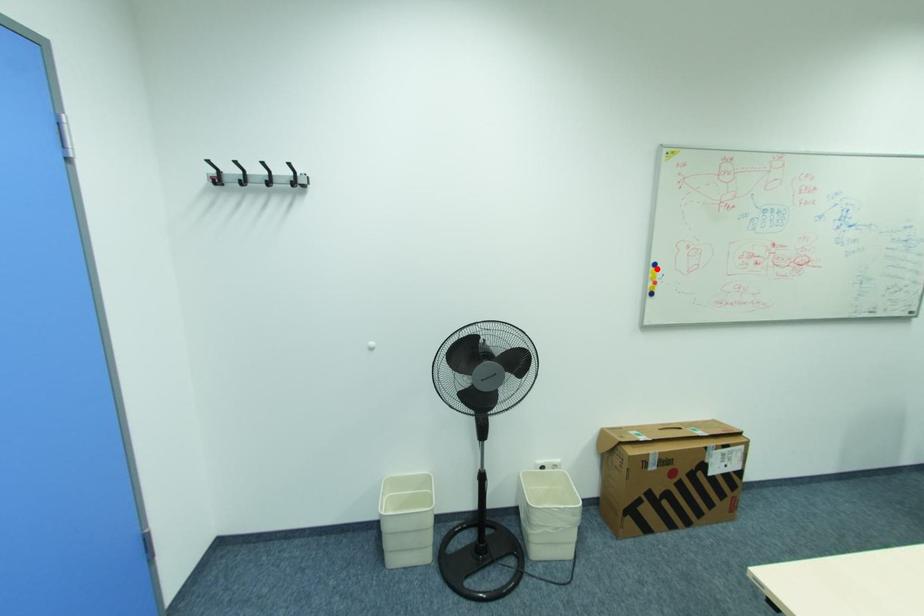
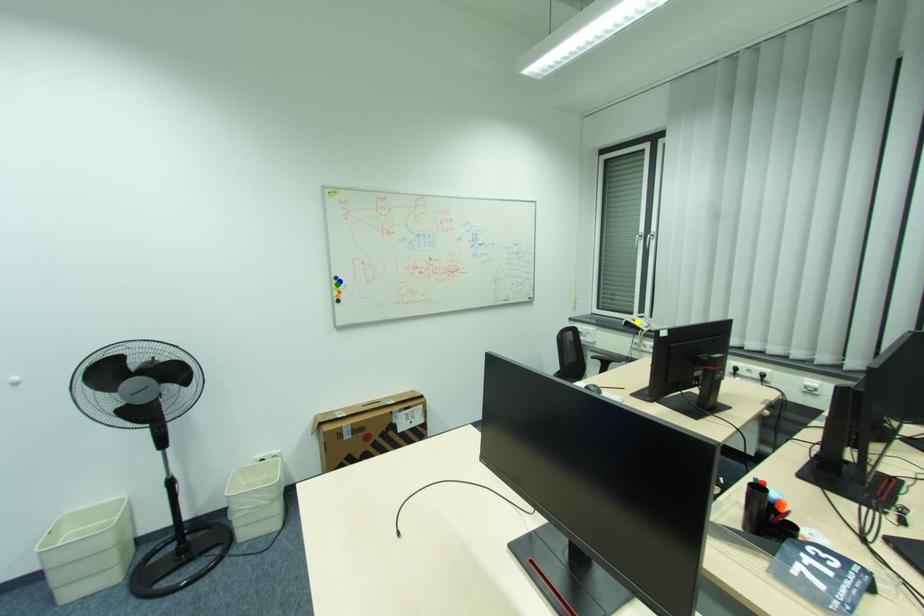
Question: I am providing you with two images of the same scene from different viewpoints. A red point is marked on the first image. You are given multiple points on the second image. Which point in image 2 represents the same 3d spot as the red point in image 1?

Choices:
 (A) yellow point
 (B) blue point
 (C) green point

Answer: (B)